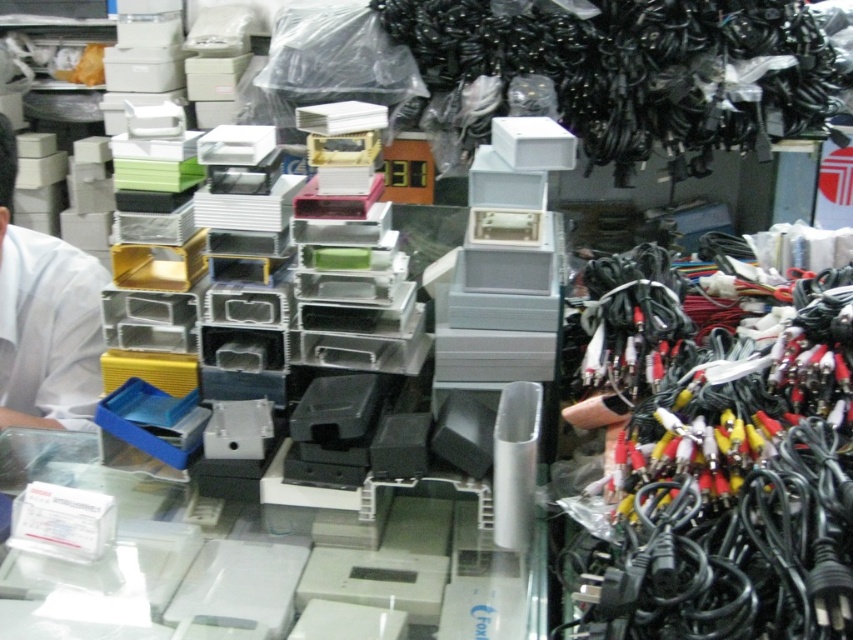
Does black rubber cables at right appear under black rubber cables at upper right?

Yes, black rubber cables at right is below black rubber cables at upper right.

Between black rubber cables at right and black rubber cables at upper right, which one is positioned higher?

Positioned higher is black rubber cables at upper right.

You are a GUI agent. You are given a task and a screenshot of the screen. Output one action in this format:
    pyautogui.click(x=<x>, y=<y>)
    Task: Click on the black rubber cables at right
    
    Given the screenshot: What is the action you would take?
    pyautogui.click(x=724, y=468)

Where is `black rubber cables at right`? The height and width of the screenshot is (640, 853). black rubber cables at right is located at coordinates (724, 468).

Does black rubber cables at upper right have a greater height compared to white matte shirt at left?

In fact, black rubber cables at upper right may be shorter than white matte shirt at left.

The width and height of the screenshot is (853, 640). What are the coordinates of `black rubber cables at upper right` in the screenshot? It's located at (637, 68).

Locate an element on the screen. The width and height of the screenshot is (853, 640). black rubber cables at upper right is located at coordinates (637, 68).

Based on the photo, is black rubber cables at right further to the viewer compared to white matte shirt at left?

No, it is in front of white matte shirt at left.

Is black rubber cables at right to the left of white matte shirt at left from the viewer's perspective?

In fact, black rubber cables at right is to the right of white matte shirt at left.

Is point (776, 348) positioned in front of point (93, 362)?

Yes.

Find the location of `black rubber cables at right`. black rubber cables at right is located at coordinates (724, 468).